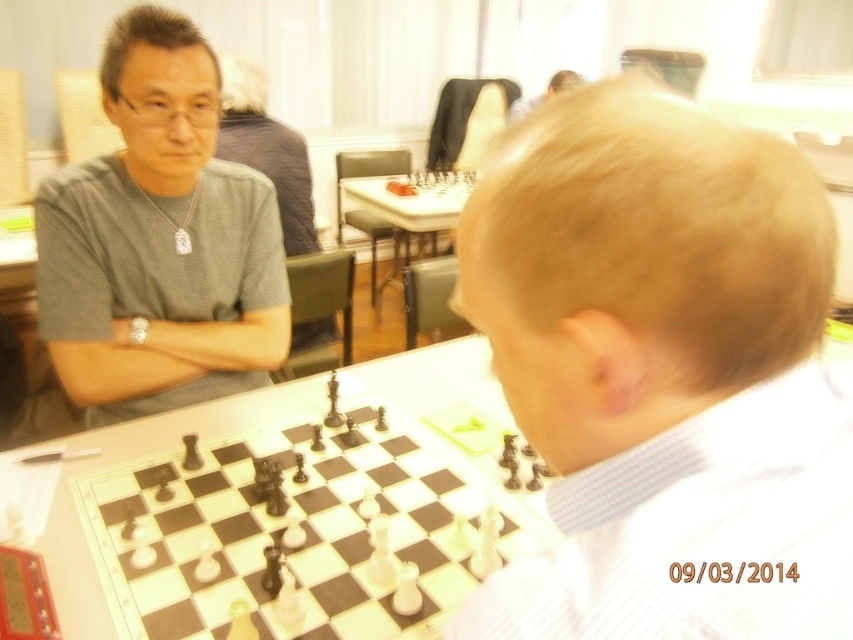
Question: Based on their relative distances, which object is nearer to the smooth skin head at upper center?

Choices:
 (A) gray matte shirt at upper left
 (B) gray matte shirt at left
 (C) polished wood chessboard at center
 (D) smooth blonde hair at center

Answer: (B)

Question: Which of the following is the farthest from the observer?

Choices:
 (A) gray matte shirt at left
 (B) gray matte shirt at upper left
 (C) smooth blonde hair at center

Answer: (A)

Question: In this image, where is polished wood chessboard at center located relative to gray matte shirt at left?

Choices:
 (A) left
 (B) right

Answer: (B)

Question: Does smooth blonde hair at center appear under gray matte shirt at upper left?

Choices:
 (A) no
 (B) yes

Answer: (B)

Question: Does polished wood chessboard at center have a larger size compared to gray matte shirt at left?

Choices:
 (A) no
 (B) yes

Answer: (B)

Question: Estimate the real-world distances between objects in this image. Which object is closer to the gray matte shirt at left?

Choices:
 (A) polished wood chessboard at center
 (B) gray matte shirt at upper left
 (C) smooth skin head at upper center
 (D) smooth blonde hair at center

Answer: (B)